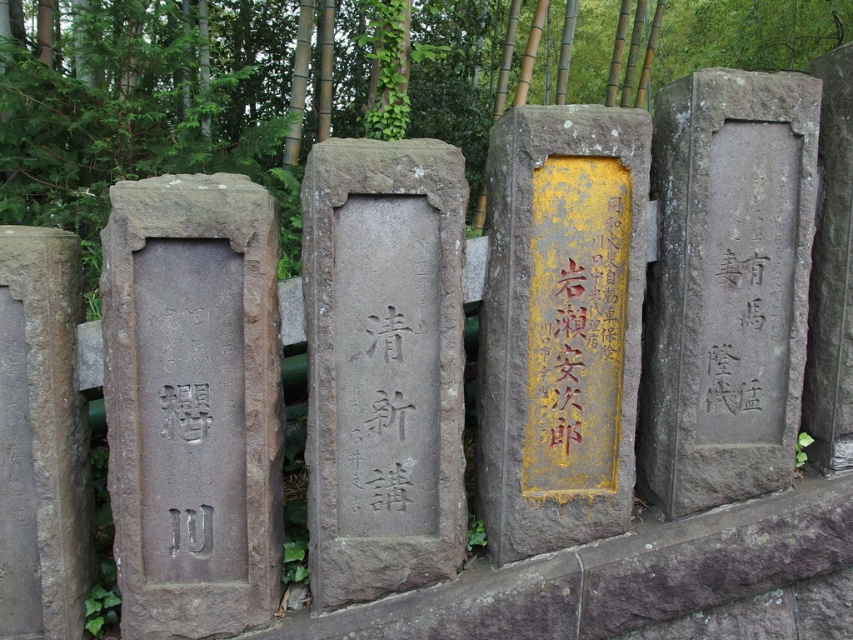
Which is in front, point (450, 440) or point (560, 227)?

Point (450, 440) is in front.

Does brown stone plaque at center have a smaller size compared to yellow painted stone at center?

Actually, brown stone plaque at center might be larger than yellow painted stone at center.

Between point (312, 182) and point (566, 349), which one is positioned in front?

Point (312, 182)

This screenshot has height=640, width=853. What are the coordinates of `brown stone plaque at center` in the screenshot? It's located at (383, 365).

Can you confirm if yellow/golden stone plaque at center is bigger than gray stone plaque at right?

Incorrect, yellow/golden stone plaque at center is not larger than gray stone plaque at right.

In the scene shown: Can you confirm if yellow/golden stone plaque at center is shorter than gray stone plaque at right?

Yes, yellow/golden stone plaque at center is shorter than gray stone plaque at right.

Does point (524, 269) lie in front of point (718, 88)?

Yes, point (524, 269) is closer to viewer.

The height and width of the screenshot is (640, 853). I want to click on yellow/golden stone plaque at center, so click(x=560, y=324).

Between brown stone plaque at center and gray stone plaque at right, which one appears on the right side from the viewer's perspective?

gray stone plaque at right

Does brown stone plaque at center appear on the right side of gray stone plaque at right?

Incorrect, brown stone plaque at center is not on the right side of gray stone plaque at right.

Who is more forward, (372, 577) or (668, 161)?

Point (372, 577) is more forward.

This screenshot has height=640, width=853. In order to click on brown stone plaque at center in this screenshot , I will do `click(383, 365)`.